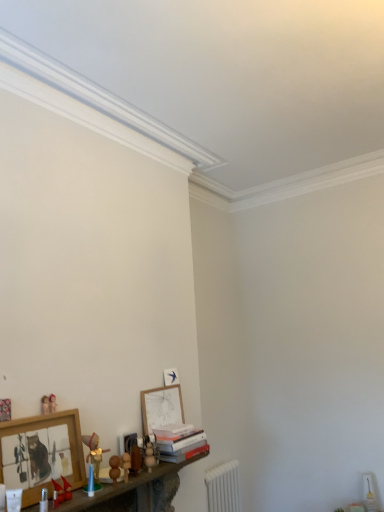
Locate an element on the screen. The width and height of the screenshot is (384, 512). vacant space situated above hardcover books at lower center (from a real-world perspective) is located at coordinates (170, 432).